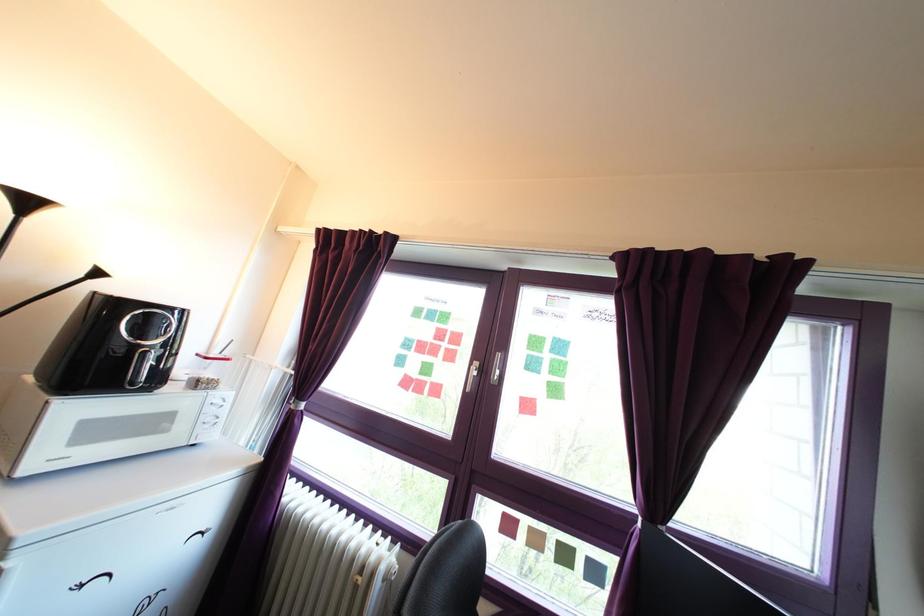
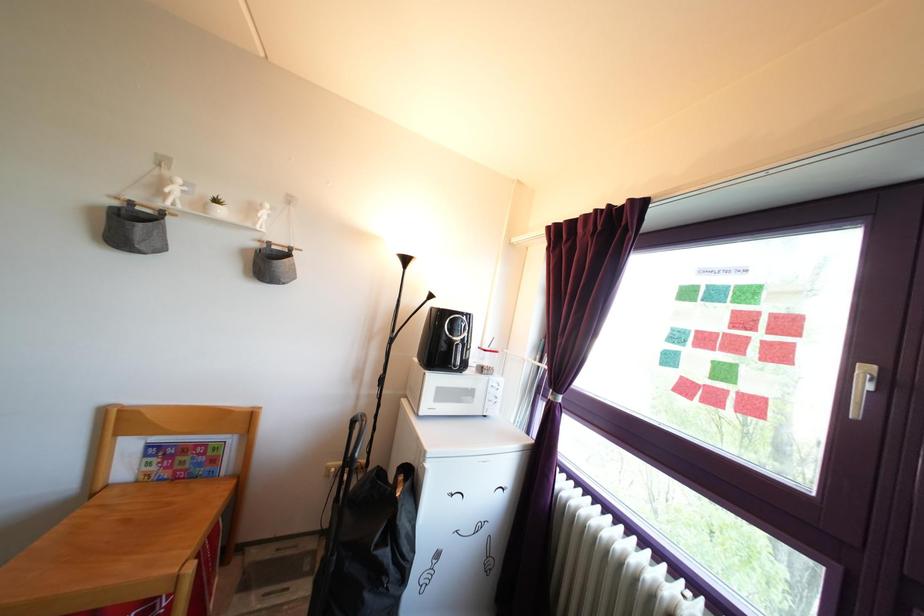
The point at (210, 383) is marked in the first image. Where is the corresponding point in the second image?

(489, 371)